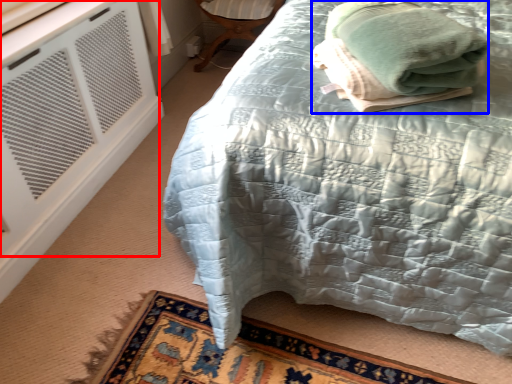
Question: Which of the following is the closest to the observer, air conditioning (highlighted by a red box) or bath towel (highlighted by a blue box)?

Choices:
 (A) air conditioning
 (B) bath towel

Answer: (B)